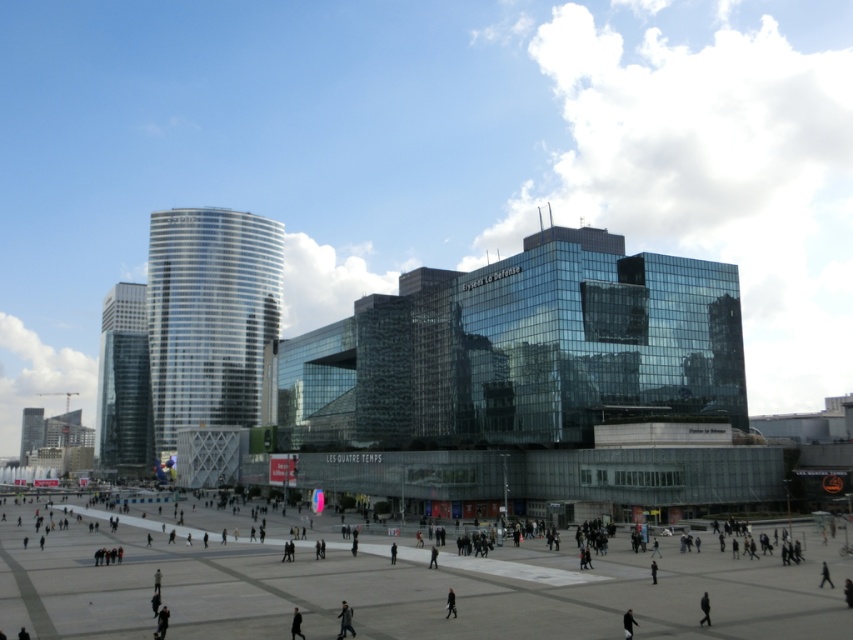
You are standing in the urban landscape and want to take a photo of the dark gray jacket at center while avoiding the concrete plaza at center in the background. Which direction should you move to ensure the jacket is visible without the plaza behind it?

The concrete plaza at center is positioned on the left side of dark gray jacket at center. To avoid the plaza in the background, you should move to the right side of the dark gray jacket at center so that the plaza is no longer behind it.

You are standing in the plaza and see two people wearing dark gray outerwear. One is wearing a dark gray jacket at center and the other a dark gray coat at lower center. Which one is more to the right?

The dark gray jacket at center is positioned on the right side of dark gray coat at lower center, so the dark gray jacket at center is more to the right.

You are a delivery person who needs to place a large package on the concrete plaza at center. The package is as tall as the dark gray jacket at center. Will the package fit on the plaza without exceeding its height limit?

The concrete plaza at center has a greater height compared to the dark gray jacket at center. Since the package is as tall as the jacket, it will not exceed the plaza height limit and can be placed there safely.